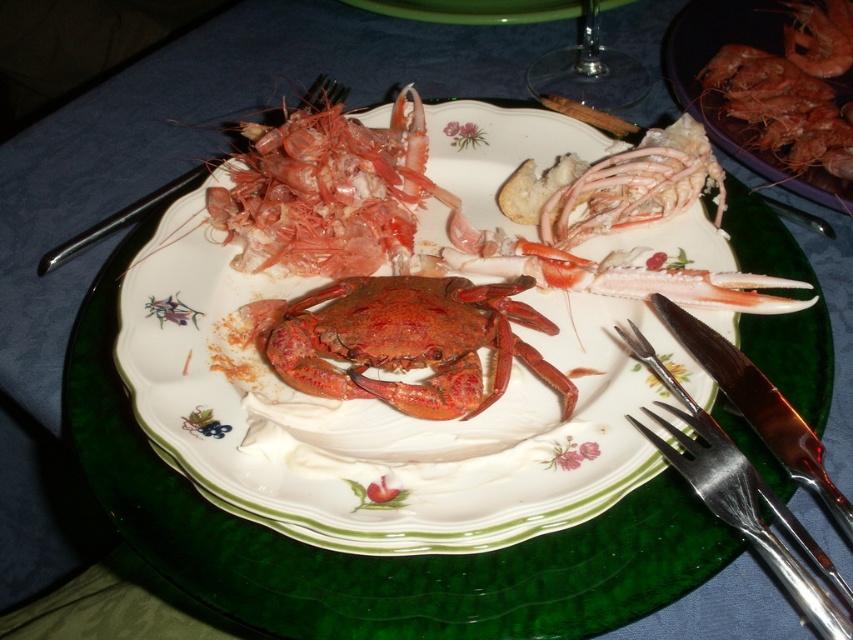
You are a diner who wants to pick up the shiny pink shrimp at upper right using the silver metallic fork at lower right. Can you reach the shrimp with the fork without moving the fork?

The silver metallic fork at lower right is positioned under the shiny pink shrimp at upper right, so yes, you can reach the shrimp with the fork by lifting it upwards since the fork is already underneath the shrimp.

You are a food photographer holding a camera at eye level. You want to capture a closeup shot of the white porcelain plate at center. Given that the plate is 23.10 inches away from the camera, what is the minimum focal length lens you need to use to ensure the entire plate fits within the frame? Assume your camera has a sensor size of 36mm x 24mm and the plate measures 12 inches in diameter.

To determine the minimum focal length required, we can use the formula for calculating focal length based on sensor size and subject distance. The plate has a diameter of 12 inches, so its width is 12 inches. The distance from the camera is 23.10 inches. Converting measurements to the same unit, let us convert inches to millimeters for consistency. 1 inch equals 25.4 mm. Therefore, the plate width is 12 inches x 25.4 mm per inch equals 304.8 mm. The distance is 23.10 inches x 25.4 mm per inch equals 586.74.

From the picture: You are a diner at a seafood restaurant and want to pick up the shiny pink shrimp at upper right using the silver metallic fork at lower right. Based on their positions, can you reach the shrimp with the fork?

The silver metallic fork at lower right is to the left of the shiny pink shrimp at upper right, so you can reach the shrimp with the fork by moving the fork from its current position to the right towards the shrimp.